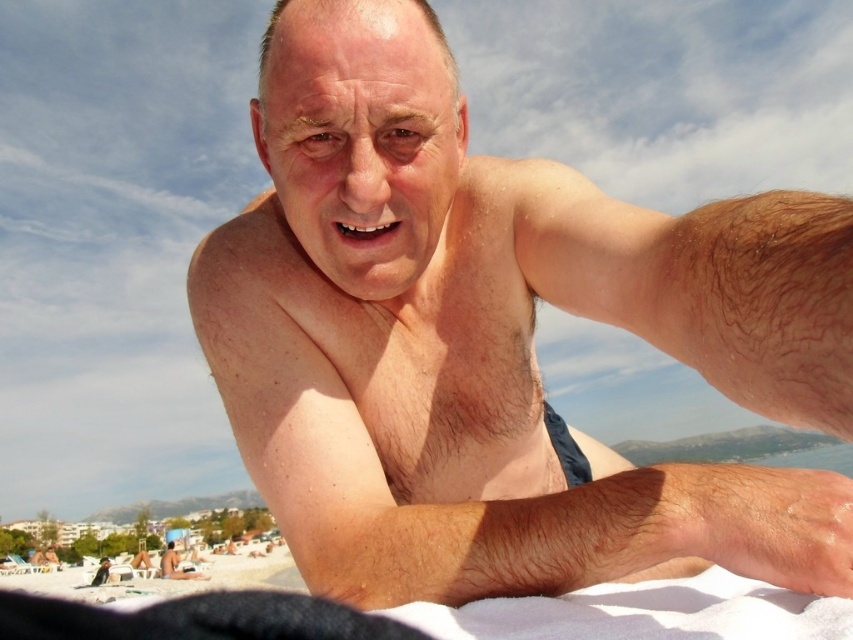
Question: Which object appears closest to the camera in this image?

Choices:
 (A) white sand at lower left
 (B) matte skin at center
 (C) smooth skin man at center

Answer: (C)

Question: Which point appears closest to the camera in this image?

Choices:
 (A) (206, 577)
 (B) (54, 579)
 (C) (351, 419)

Answer: (C)

Question: Is smooth skin man at center closer to the viewer compared to matte skin at center?

Choices:
 (A) no
 (B) yes

Answer: (B)

Question: Is smooth skin man at center above matte skin at center?

Choices:
 (A) yes
 (B) no

Answer: (A)

Question: Is smooth skin man at center to the left of matte skin at center from the viewer's perspective?

Choices:
 (A) no
 (B) yes

Answer: (A)

Question: Which object appears farthest from the camera in this image?

Choices:
 (A) smooth skin man at center
 (B) matte skin at center
 (C) white sand at lower left

Answer: (B)